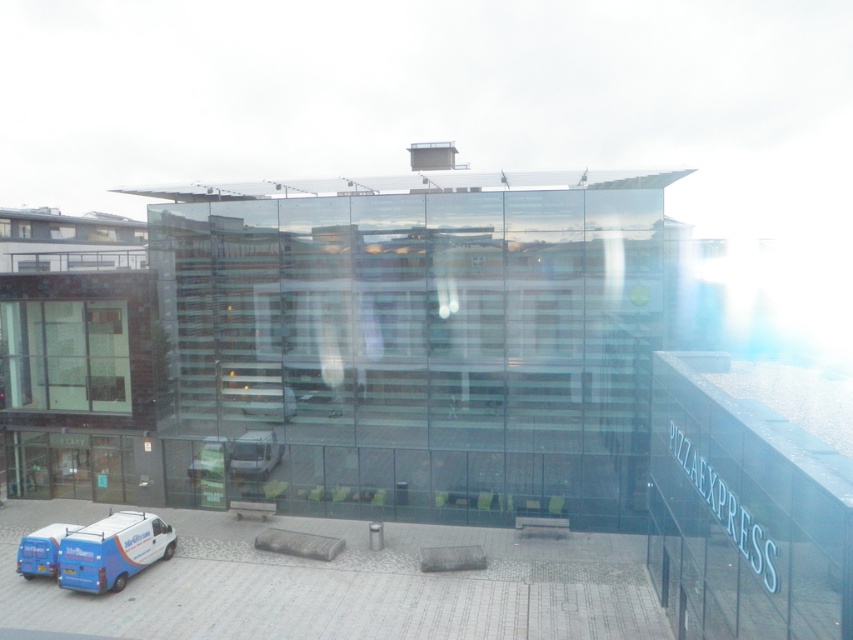
Is point (242, 440) more distant than point (299, 413)?

That is True.

Who is lower down, white matte van at center or blue metallic van at center?

white matte van at center

Between point (225, 442) and point (323, 396), which one is positioned in front?

Point (323, 396) is more forward.

You are a GUI agent. You are given a task and a screenshot of the screen. Output one action in this format:
    pyautogui.click(x=<x>, y=<y>)
    Task: Click on the white matte van at center
    
    Given the screenshot: What is the action you would take?
    pyautogui.click(x=236, y=456)